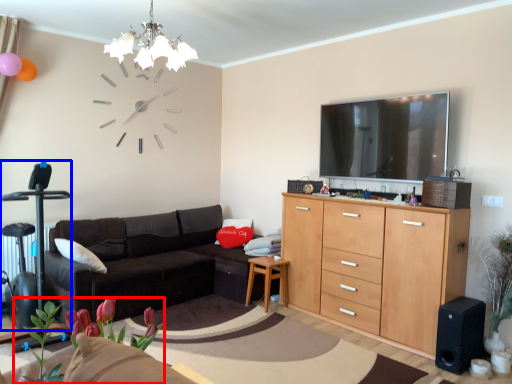
Question: Among these objects, which one is nearest to the camera, plant (highlighted by a red box) or swivel chair (highlighted by a blue box)?

Choices:
 (A) plant
 (B) swivel chair

Answer: (A)